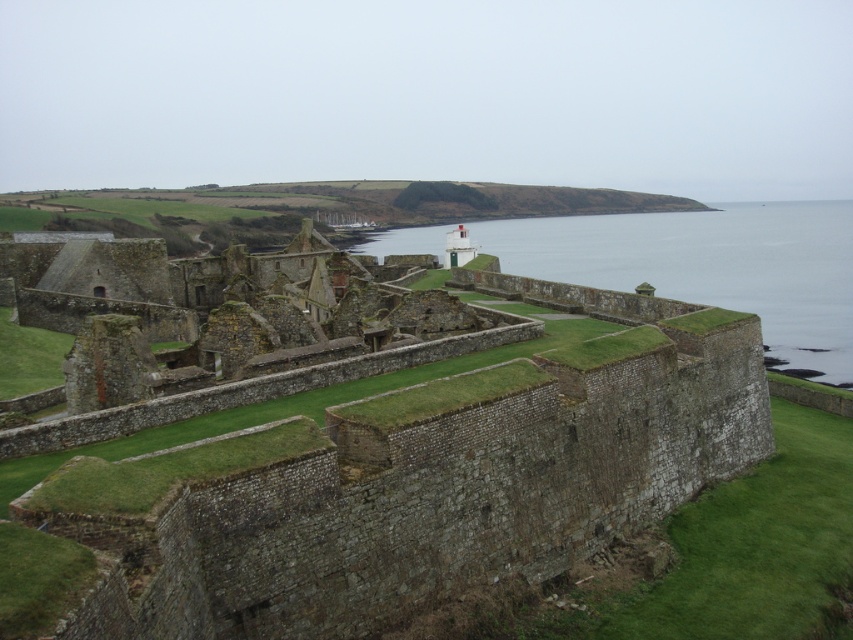
Between stone wall at center and clear water at center, which one has more height?

clear water at center

Is stone wall at center shorter than clear water at center?

Correct, stone wall at center is not as tall as clear water at center.

Is point (154, 342) farther from viewer compared to point (415, 234)?

No.

Identify the location of stone wall at center. (415, 481).